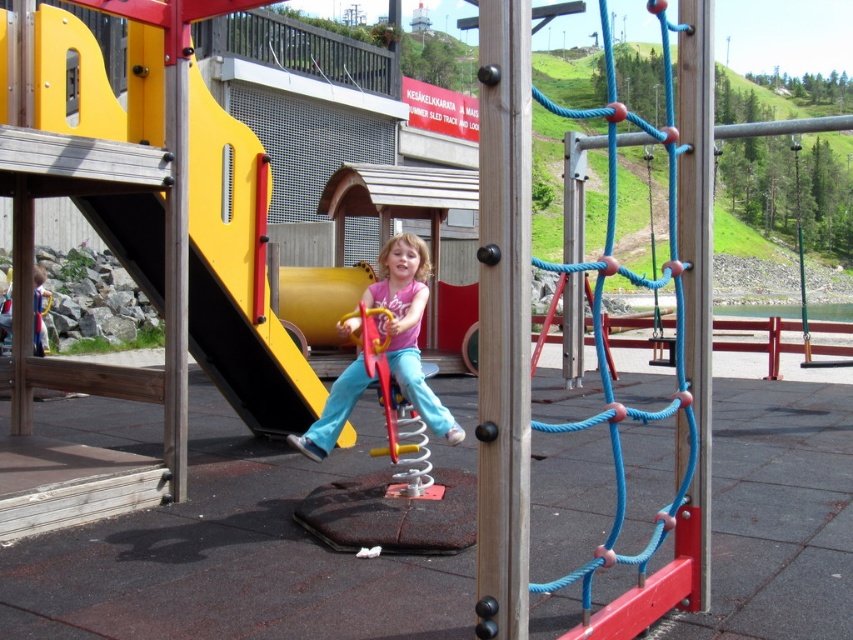
You are a parent supervising children at the playground. You notice the blue rope swing at center right and the pink matte shirt at center. Which object is bigger?

The blue rope swing at center right is larger in size than the pink matte shirt at center.

You are a parent supervising children at the playground. You notice the blue rope swing at center right and the pink matte shirt at center. Which object is located to the right of the other?

The blue rope swing at center right is positioned on the right side of pink matte shirt at center.

You are standing at the playground and want to reach a specific point marked at coordinates point [672,404]. If you can walk 3 meters in one minute, how long will it take you to reach that point?

The distance of point [672,404] from viewer is 3.27 meters. At a walking speed of 3 meters per minute, it would take approximately 1.09 minutes, or about 1 minute and 6 seconds, to reach the point.